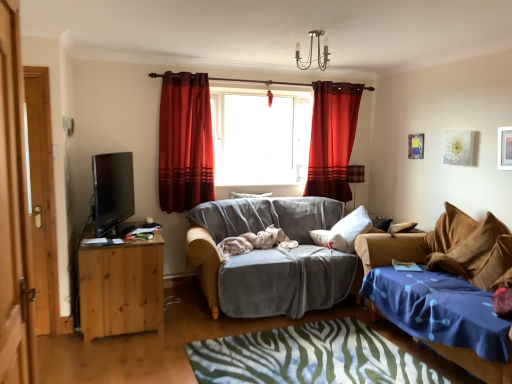
In order to click on spots to the right of wooden door at left, the 2th door when ordered from front to back in this screenshot , I will do `click(61, 336)`.